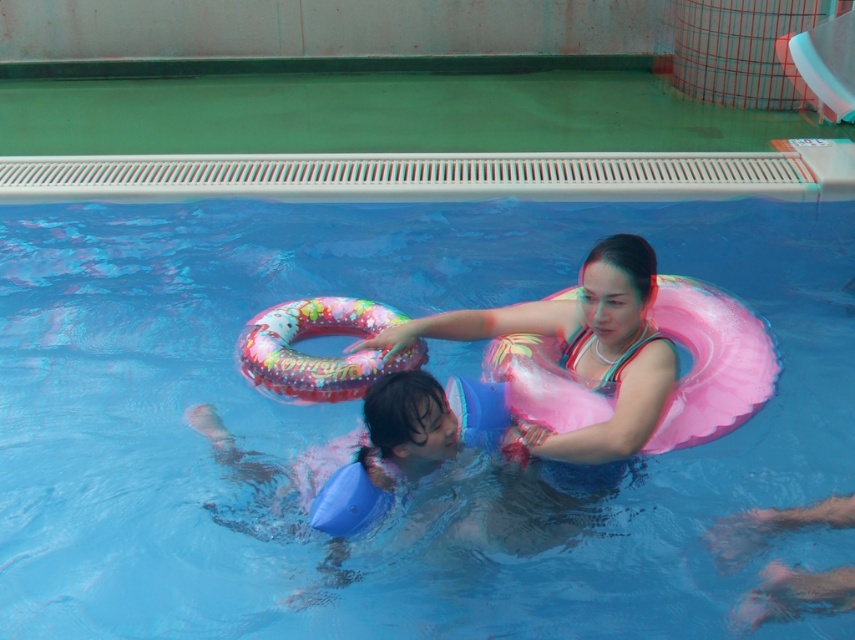
Is point (6, 518) farther from camera compared to point (608, 312)?

Yes, point (6, 518) is behind point (608, 312).

The image size is (855, 640). What are the coordinates of `blue rubber ring at center` in the screenshot? It's located at (358, 412).